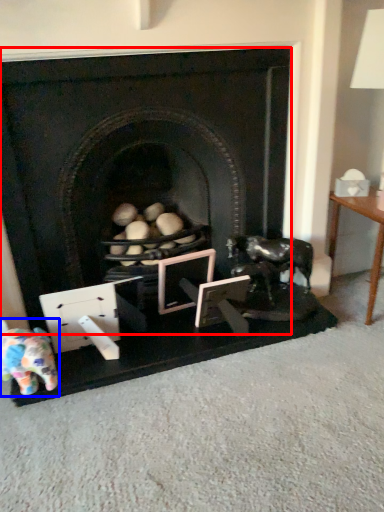
Question: Which of the following is the closest to the observer, fireplace (highlighted by a red box) or toy (highlighted by a blue box)?

Choices:
 (A) fireplace
 (B) toy

Answer: (A)